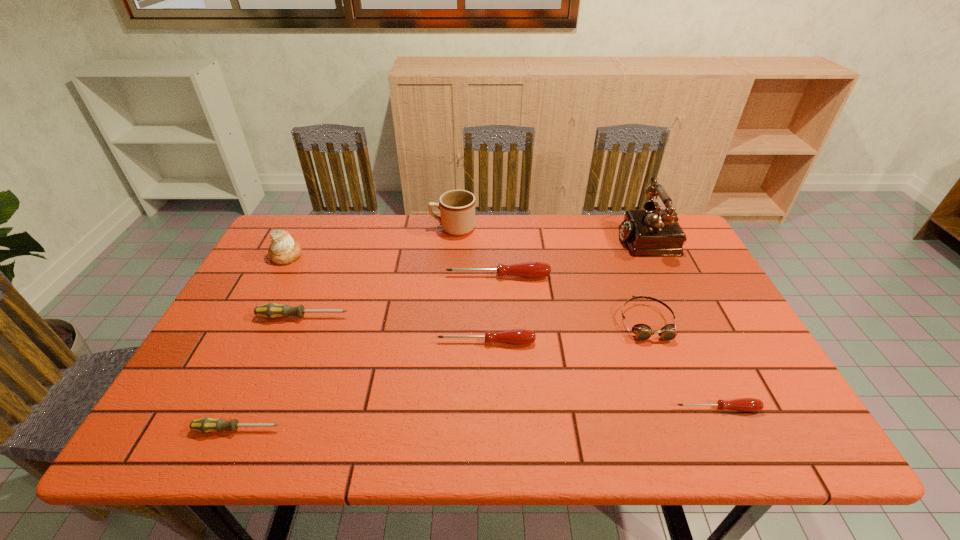
The image size is (960, 540). Find the location of `the tallest object`. the tallest object is located at coordinates (652, 232).

I want to click on brown telephone, so click(x=652, y=232).

The height and width of the screenshot is (540, 960). I want to click on mug, so click(457, 207).

Where is `brown mug`? brown mug is located at coordinates (457, 207).

You are a GUI agent. You are given a task and a screenshot of the screen. Output one action in this format:
    pyautogui.click(x=<x>, y=<y>)
    Task: Click on the third tallest object
    The width and height of the screenshot is (960, 540).
    Given the screenshot: What is the action you would take?
    pyautogui.click(x=283, y=250)

At what (x,y) coordinates should I click in order to perform the action: click on the farthest red screwdriver. Please return your answer as a coordinate pair (x, y). Image resolution: width=960 pixels, height=540 pixels. Looking at the image, I should click on (529, 269).

Locate an element on the screen. The width and height of the screenshot is (960, 540). the farthest screwdriver is located at coordinates (529, 269).

At what (x,y) coordinates should I click in order to perform the action: click on goggles. Please return your answer as a coordinate pair (x, y). The width and height of the screenshot is (960, 540). Looking at the image, I should click on (642, 332).

Identify the location of the farther gray screwdriver. (271, 310).

This screenshot has width=960, height=540. I want to click on the fourth nearest screwdriver, so click(271, 310).